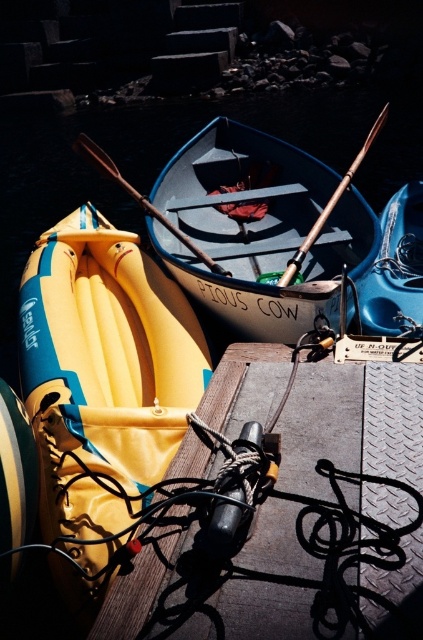
Question: Is yellow fabric kayak at left to the left of matte blue canoe at center from the viewer's perspective?

Choices:
 (A) yes
 (B) no

Answer: (A)

Question: Among these points, which one is farthest from the camera?

Choices:
 (A) (297, 227)
 (B) (106, 166)
 (C) (323, 220)
 (D) (176, 440)

Answer: (A)

Question: Which point is farther to the camera?

Choices:
 (A) (288, 278)
 (B) (101, 458)
 (C) (304, 292)

Answer: (A)

Question: Which of the following is the farthest from the observer?

Choices:
 (A) (244, 273)
 (B) (87, 212)

Answer: (B)

Question: Does yellow fabric kayak at left have a lesser width compared to wooden oar at center?

Choices:
 (A) yes
 (B) no

Answer: (A)

Question: Does yellow fabric kayak at left have a smaller size compared to wooden oar at center?

Choices:
 (A) no
 (B) yes

Answer: (B)